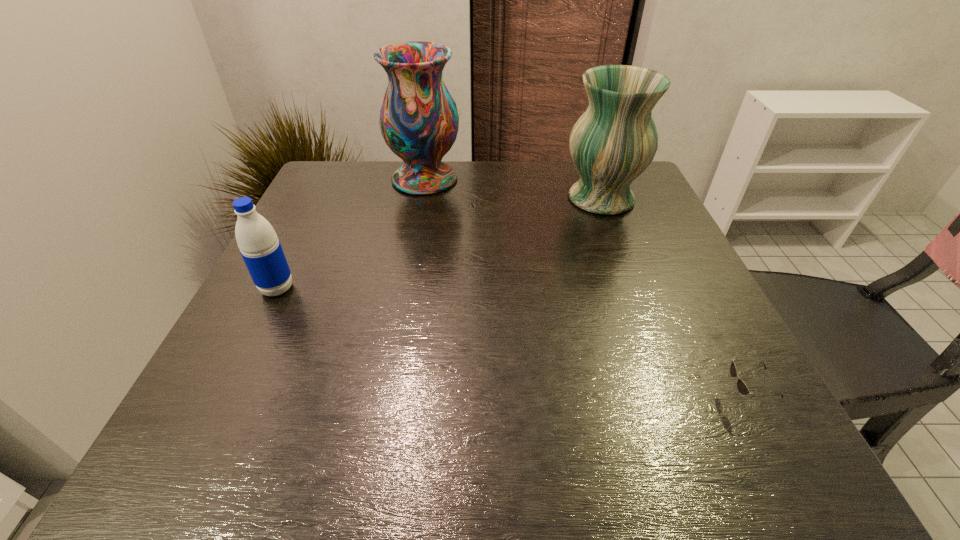
This screenshot has width=960, height=540. Find the location of `vacant area situated in front of the lenses of the nearest object`. vacant area situated in front of the lenses of the nearest object is located at coordinates (692, 397).

This screenshot has height=540, width=960. I want to click on free space located 0.130m in front of the lenses of the nearest object, so click(642, 397).

What are the coordinates of `object at the near edge` in the screenshot? It's located at (742, 387).

What are the coordinates of `object that is at the left edge` in the screenshot? It's located at (260, 248).

At what (x,y) coordinates should I click in order to perform the action: click on vase at the right edge. Please return your answer as a coordinate pair (x, y). The image size is (960, 540). Looking at the image, I should click on (613, 142).

The height and width of the screenshot is (540, 960). I want to click on sunglasses that is at the right edge, so click(x=742, y=387).

Identify the location of object positioned at the far right corner. click(613, 142).

Find the location of a particular element. object present at the near right corner is located at coordinates (742, 387).

This screenshot has height=540, width=960. Find the location of `vacant space at the far edge of the desktop`. vacant space at the far edge of the desktop is located at coordinates (483, 180).

The image size is (960, 540). What are the coordinates of `free space at the near edge of the desktop` in the screenshot? It's located at (598, 471).